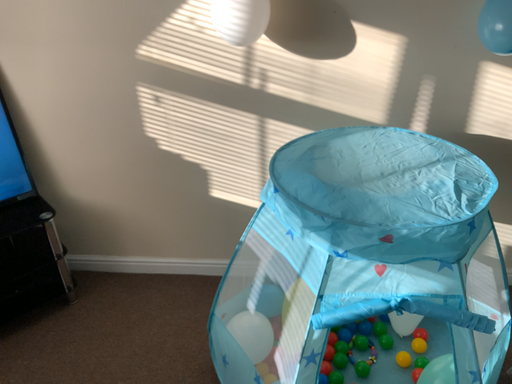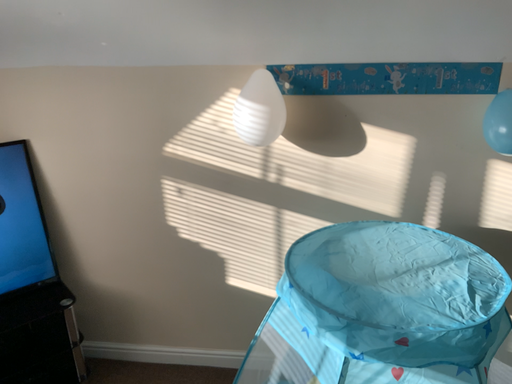
Question: How did the camera likely rotate when shooting the video?

Choices:
 (A) rotated downward
 (B) rotated upward

Answer: (B)